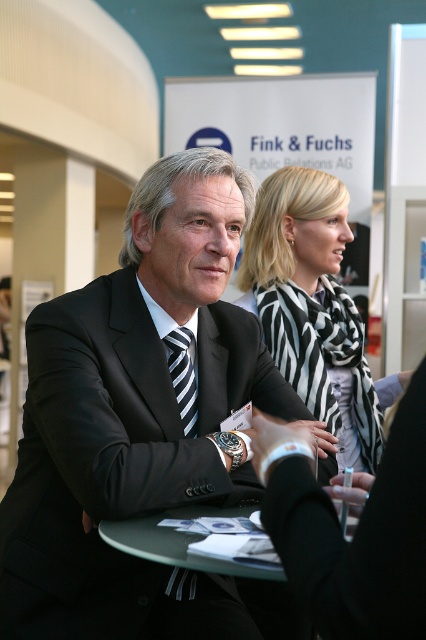
You are organizing a photo shoot and need to place a small decorative item on the table where the matte black suit at center is located. Considering the size of the object, will the black and white scarf at upper center be able to fit on the same table without overlapping?

The matte black suit at center has a larger size compared to black and white scarf at upper center. Since the scarf is smaller, it can fit on the same table without overlapping as long as there is enough space allocated for both items.

You are organizing a photo shoot and need to ensure that the black and white scarf at upper center and the striped fabric tie at center are visible in the frame. Based on their positions, which object should you focus on first to ensure both are in the frame?

The black and white scarf at upper center is taller than the striped fabric tie at center, so focusing on the black and white scarf at upper center first will ensure both are in the frame since it occupies a larger vertical space.

You are organizing a photo shoot and need to ensure that the matte black suit at center and the black and white scarf at upper center are visible in the frame. Based on their positions, which object is closer to the camera?

The black and white scarf at upper center is closer to the camera because it is positioned above the matte black suit at center, which is placed underneath it.